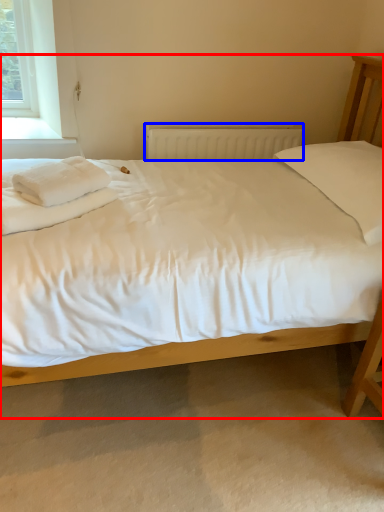
Question: Which object is closer to the camera taking this photo, bed (highlighted by a red box) or radiator (highlighted by a blue box)?

Choices:
 (A) bed
 (B) radiator

Answer: (A)